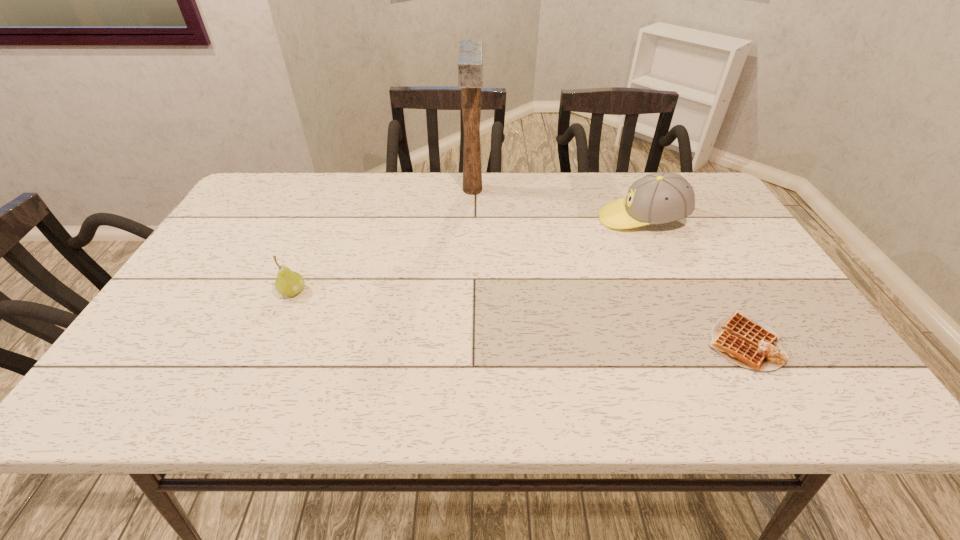
The image size is (960, 540). I want to click on mallet, so click(x=470, y=52).

This screenshot has width=960, height=540. What are the coordinates of `the tallest object` in the screenshot? It's located at (470, 52).

Locate an element on the screen. Image resolution: width=960 pixels, height=540 pixels. baseball cap is located at coordinates (663, 197).

Locate an element on the screen. The image size is (960, 540). pear is located at coordinates [x=288, y=283].

Where is `the leftmost object`? the leftmost object is located at coordinates pyautogui.click(x=288, y=283).

Locate an element on the screen. Image resolution: width=960 pixels, height=540 pixels. the nearest object is located at coordinates (752, 344).

Find the location of a particular element. Image resolution: width=960 pixels, height=540 pixels. waffle is located at coordinates (752, 344).

Identify the location of free location located 0.290m on the front of the second object from left to right. (470, 273).

Identify the location of free space located 0.170m on the front-facing side of the baseball cap. pyautogui.click(x=540, y=219).

I want to click on vacant region located 0.200m on the front-facing side of the baseball cap, so click(x=530, y=219).